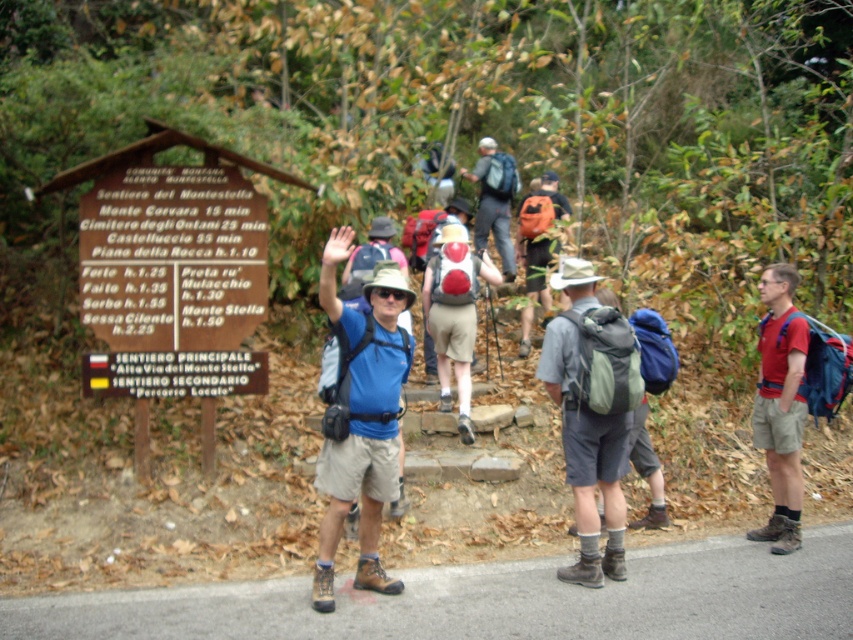
Question: Observing the image, what is the correct spatial positioning of brown leather boots at lower center in reference to red fabric shirt at right?

Choices:
 (A) below
 (B) above

Answer: (A)

Question: Which is farther from the gray fabric backpack at center?

Choices:
 (A) matte red backpack at center
 (B) matte blue backpack at center
 (C) brown leather boots at lower center

Answer: (B)

Question: Is brown leather boots at lower center further to camera compared to blue fabric shirt at center?

Choices:
 (A) yes
 (B) no

Answer: (A)

Question: Does blue fabric shirt at center lie behind gray fabric backpack at center?

Choices:
 (A) no
 (B) yes

Answer: (A)

Question: Which object is the closest to the brown wooden sign at upper center?

Choices:
 (A) blue fabric shirt at center
 (B) red fabric shirt at right

Answer: (A)

Question: Considering the real-world distances, which object is farthest from the matte red backpack at center?

Choices:
 (A) gray fabric backpack at center
 (B) matte blue backpack at center
 (C) blue fabric shirt at center

Answer: (B)